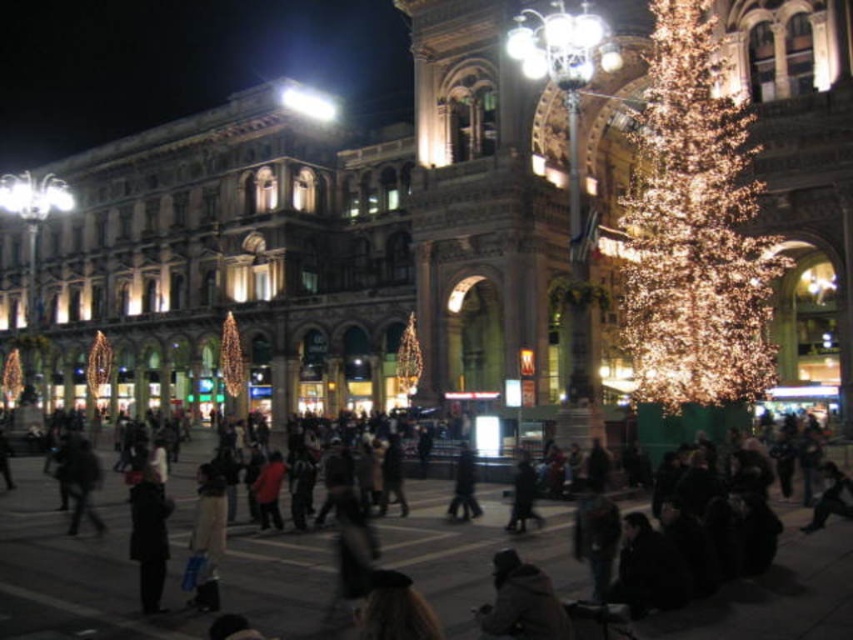
You are a tourist standing at the entrance of the square. You want to take a photo of the grand building with classical architectural features without any people in the frame. The dark clothing crowd at center is located at point (84,566). Where should you position yourself to avoid the crowd?

To avoid the dark clothing crowd at center located at point (84,566), you should position yourself on the opposite side of the square, away from the crowd. This will ensure the grand building with classical architectural features is clearly visible without any obstruction from the crowd.

You are a photographer standing in the square and want to take a photo of the dark gray coat at lower left without the dark clothing crowd at center blocking it. What should you do?

Move to a position behind the dark clothing crowd at center so that you can see the dark gray coat at lower left, since the dark clothing crowd at center is in front of it.

Looking at this image, you are a delivery person with a cart that is 1.5 meters wide. You need to navigate through the square to deliver packages to the building. The path you must take goes between the dark clothing crowd at center and the dark gray coat at lower left. Can your cart fit through this path?

The path between the dark clothing crowd at center and the dark gray coat at lower left is 8.34 meters wide. Since your cart is only 1.5 meters wide, it will easily fit through the path between the dark clothing crowd at center and the dark gray coat at lower left.